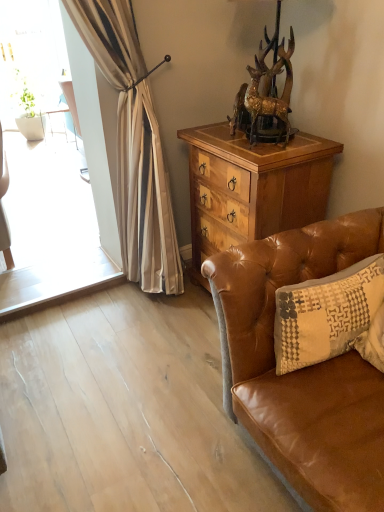
Find the location of a particular element. Image resolution: width=384 pixels, height=512 pixels. vacant space in front of gold metallic deer at upper center is located at coordinates (269, 153).